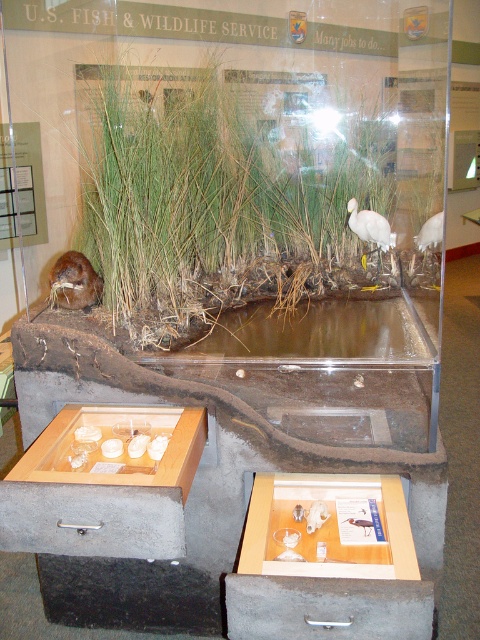
Can you confirm if brown furry beaver at lower left is positioned to the left of white feathered bird at upper center?

Correct, you'll find brown furry beaver at lower left to the left of white feathered bird at upper center.

Does brown furry beaver at lower left appear over white feathered bird at upper center?

Actually, brown furry beaver at lower left is below white feathered bird at upper center.

You are a GUI agent. You are given a task and a screenshot of the screen. Output one action in this format:
    pyautogui.click(x=<x>, y=<y>)
    Task: Click on the brown furry beaver at lower left
    
    Given the screenshot: What is the action you would take?
    pyautogui.click(x=73, y=282)

The width and height of the screenshot is (480, 640). Find the location of `brown furry beaver at lower left`. brown furry beaver at lower left is located at coordinates (73, 282).

Does brown furry beaver at lower left lie behind white matte bird at upper center?

That is True.

Is brown furry beaver at lower left in front of white matte bird at upper center?

No.

Image resolution: width=480 pixels, height=640 pixels. What are the coordinates of `brown furry beaver at lower left` in the screenshot? It's located at (73, 282).

Between point (314, 524) and point (349, 522), which one is positioned in front?

Point (314, 524) is in front.

Consider the image. Is white glossy bird at upper center to the right of white matte bird at upper center from the viewer's perspective?

No, white glossy bird at upper center is not to the right of white matte bird at upper center.

At what (x,y) coordinates should I click in order to perform the action: click on white glossy bird at upper center. Please return your answer as a coordinate pair (x, y). The height and width of the screenshot is (640, 480). Looking at the image, I should click on [x=316, y=515].